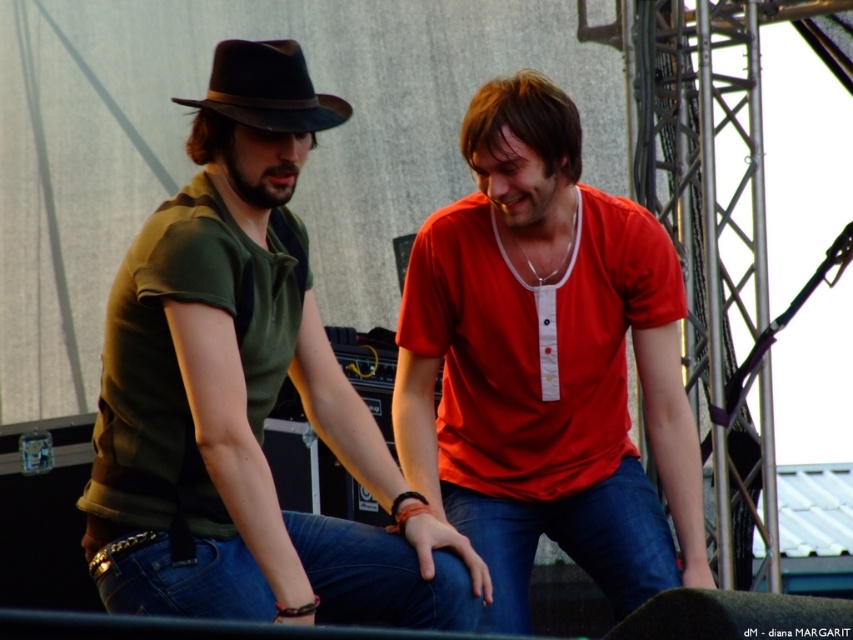
Question: Among these points, which one is nearest to the camera?

Choices:
 (A) (618, 593)
 (B) (299, 72)
 (C) (364, 552)
 (D) (535, 548)

Answer: (C)

Question: Which of the following is the closest to the observer?

Choices:
 (A) (259, 586)
 (B) (171, 374)

Answer: (A)

Question: Does green matte shirt at center appear over red matte shirt at center?

Choices:
 (A) no
 (B) yes

Answer: (A)

Question: Is blue denim jeans at center positioned behind black felt fedora at upper left?

Choices:
 (A) no
 (B) yes

Answer: (A)

Question: Does red matte shirt at center appear on the left side of black felt fedora at upper left?

Choices:
 (A) yes
 (B) no

Answer: (B)

Question: Which of the following is the closest to the observer?

Choices:
 (A) (201, 275)
 (B) (329, 100)

Answer: (A)